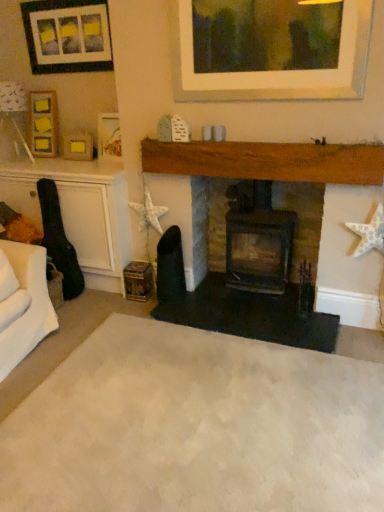
Question: Does matte black picture frame at upper left, acting as the first picture frame starting from the top, come in front of matte wooden picture frame at upper left, arranged as the 2th picture frame when ordered from the bottom?

Choices:
 (A) yes
 (B) no

Answer: (A)

Question: Does matte black picture frame at upper left, acting as the first picture frame starting from the top, appear on the left side of matte wooden picture frame at upper left, the third picture frame viewed from the top?

Choices:
 (A) no
 (B) yes

Answer: (B)

Question: Considering the relative sizes of matte black picture frame at upper left, acting as the 4th picture frame starting from the bottom, and matte wooden picture frame at upper left, the third picture frame viewed from the top, in the image provided, is matte black picture frame at upper left, acting as the 4th picture frame starting from the bottom, taller than matte wooden picture frame at upper left, the third picture frame viewed from the top,?

Choices:
 (A) no
 (B) yes

Answer: (B)

Question: Is matte black picture frame at upper left, acting as the first picture frame starting from the top, smaller than matte wooden picture frame at upper left, the third picture frame viewed from the top?

Choices:
 (A) yes
 (B) no

Answer: (B)

Question: Does matte black picture frame at upper left, acting as the first picture frame starting from the top, have a lesser width compared to matte wooden picture frame at upper left, the third picture frame viewed from the top?

Choices:
 (A) no
 (B) yes

Answer: (B)

Question: From the image's perspective, is matte black picture frame at upper left, acting as the 4th picture frame starting from the bottom, on matte wooden picture frame at upper left, arranged as the 2th picture frame when ordered from the bottom?

Choices:
 (A) yes
 (B) no

Answer: (A)

Question: Considering the relative sizes of beige carpet at center and black matte fireplace at center, the second fireplace positioned from the left, in the image provided, is beige carpet at center shorter than black matte fireplace at center, the second fireplace positioned from the left,?

Choices:
 (A) yes
 (B) no

Answer: (A)

Question: Can you confirm if beige carpet at center is thinner than black matte fireplace at center, the first fireplace viewed from the right?

Choices:
 (A) yes
 (B) no

Answer: (B)

Question: Does beige carpet at center appear on the right side of black matte fireplace at center, the second fireplace positioned from the left?

Choices:
 (A) no
 (B) yes

Answer: (A)

Question: Is beige carpet at center oriented away from black matte fireplace at center, the first fireplace viewed from the right?

Choices:
 (A) no
 (B) yes

Answer: (A)

Question: From a real-world perspective, is beige carpet at center over black matte fireplace at center, the first fireplace viewed from the right?

Choices:
 (A) no
 (B) yes

Answer: (A)

Question: Is beige carpet at center bigger than black matte fireplace at center, the first fireplace viewed from the right?

Choices:
 (A) yes
 (B) no

Answer: (B)

Question: Is matte wooden picture frame at upper left, arranged as the 2th picture frame when ordered from the bottom, far from black matte fireplace at center, the second fireplace positioned from the left?

Choices:
 (A) no
 (B) yes

Answer: (B)